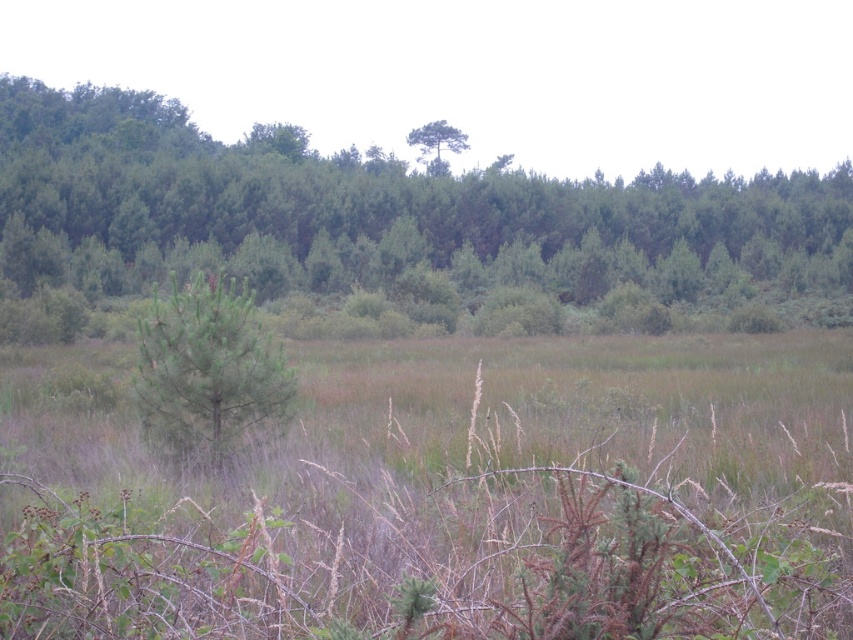
You are standing in the open area of the forest and see the green leafy tree at center and the green matte tree at center. Which tree is positioned to the left?

The green leafy tree at center is positioned to the left of the green matte tree at center.

You are standing at the origin point of the image. Which direction should you move to reach the green leafy tree at center?

The green leafy tree at center is located at point coordinates of (378, 211), so you should move towards the center of the image to reach it.